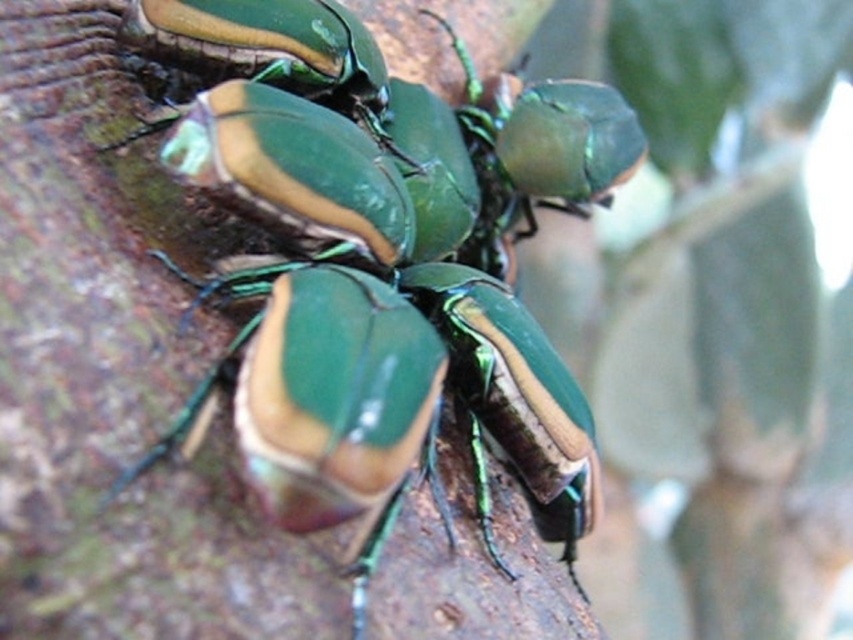
How distant is metallic green beetle at center from metallic green beetle at upper center?

A distance of 16.75 inches exists between metallic green beetle at center and metallic green beetle at upper center.

Is metallic green beetle at center smaller than metallic green beetle at upper center?

Actually, metallic green beetle at center might be larger than metallic green beetle at upper center.

Is point (256, 435) closer to camera compared to point (579, 198)?

Yes, it is.

The height and width of the screenshot is (640, 853). Find the location of `metallic green beetle at center`. metallic green beetle at center is located at coordinates (396, 397).